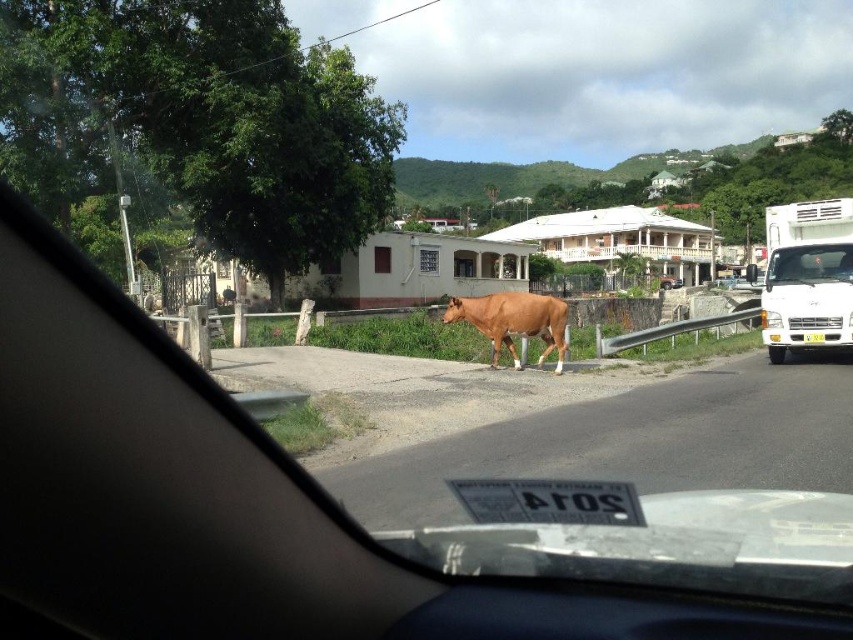
Can you confirm if matte white truck at center is positioned to the left of white matte truck at right?

Correct, you'll find matte white truck at center to the left of white matte truck at right.

Is matte white truck at center smaller than white matte truck at right?

Actually, matte white truck at center might be larger than white matte truck at right.

Which is behind, point (119, 592) or point (842, 346)?

Positioned behind is point (842, 346).

You are a GUI agent. You are given a task and a screenshot of the screen. Output one action in this format:
    pyautogui.click(x=<x>, y=<y>)
    Task: Click on the matte white truck at center
    
    Given the screenshot: What is the action you would take?
    pyautogui.click(x=270, y=509)

Looking at this image, is matte white truck at center wider than brown glossy bull at center?

Correct, the width of matte white truck at center exceeds that of brown glossy bull at center.

Does matte white truck at center have a greater height compared to brown glossy bull at center?

Indeed, matte white truck at center has a greater height compared to brown glossy bull at center.

Between point (300, 506) and point (537, 324), which one is positioned behind?

The point (537, 324) is behind.

I want to click on matte white truck at center, so click(270, 509).

Who is positioned more to the left, white matte truck at right or brown glossy bull at center?

brown glossy bull at center is more to the left.

Which is above, white matte truck at right or brown glossy bull at center?

white matte truck at right is above.

Does point (782, 317) come behind point (502, 316)?

Yes, point (782, 317) is farther from viewer.

Locate an element on the screen. white matte truck at right is located at coordinates (807, 298).